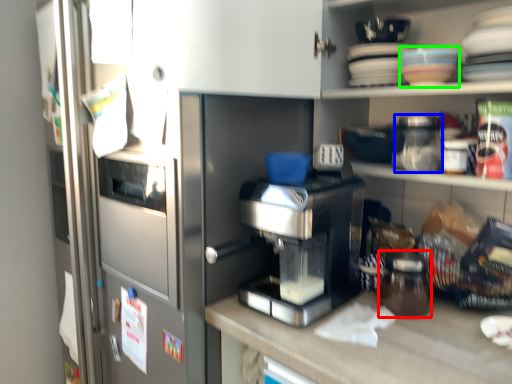
Question: Estimate the real-world distances between objects in this image. Which object is farther from glass jar (highlighted by a red box), glass jar (highlighted by a blue box) or tableware (highlighted by a green box)?

Choices:
 (A) glass jar
 (B) tableware

Answer: (B)